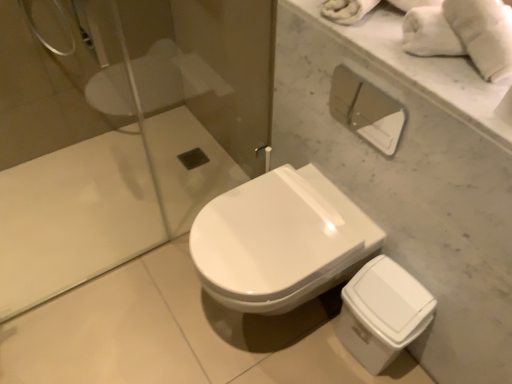
Question: Considering the relative sizes of white fluffy towel at upper right and white matte toilet paper at upper right in the image provided, is white fluffy towel at upper right thinner than white matte toilet paper at upper right?

Choices:
 (A) yes
 (B) no

Answer: (B)

Question: Would you say white fluffy towel at upper right is a long distance from white matte toilet paper at upper right?

Choices:
 (A) no
 (B) yes

Answer: (A)

Question: From a real-world perspective, does white fluffy towel at upper right sit lower than white matte toilet paper at upper right?

Choices:
 (A) yes
 (B) no

Answer: (B)

Question: Is the position of white fluffy towel at upper right less distant than that of white matte toilet paper at upper right?

Choices:
 (A) yes
 (B) no

Answer: (A)

Question: Is white fluffy towel at upper right with white matte toilet paper at upper right?

Choices:
 (A) yes
 (B) no

Answer: (B)

Question: Considering the relative sizes of white fluffy towel at upper right and white matte toilet paper at upper right in the image provided, is white fluffy towel at upper right smaller than white matte toilet paper at upper right?

Choices:
 (A) yes
 (B) no

Answer: (B)

Question: Considering the relative sizes of white matte toilet paper at upper right and white fluffy towel at upper right in the image provided, is white matte toilet paper at upper right wider than white fluffy towel at upper right?

Choices:
 (A) no
 (B) yes

Answer: (A)

Question: Is white matte toilet paper at upper right not within white fluffy towel at upper right?

Choices:
 (A) no
 (B) yes

Answer: (B)

Question: Is white matte toilet paper at upper right closer to camera compared to white fluffy towel at upper right?

Choices:
 (A) no
 (B) yes

Answer: (A)

Question: Are white matte toilet paper at upper right and white fluffy towel at upper right beside each other?

Choices:
 (A) no
 (B) yes

Answer: (A)

Question: Considering the relative sizes of white matte toilet paper at upper right and white fluffy towel at upper right in the image provided, is white matte toilet paper at upper right smaller than white fluffy towel at upper right?

Choices:
 (A) yes
 (B) no

Answer: (A)

Question: Would you say white matte toilet paper at upper right is a long distance from white fluffy towel at upper right?

Choices:
 (A) yes
 (B) no

Answer: (B)

Question: Is there a large distance between white glossy toilet at center and white fluffy towel at upper right?

Choices:
 (A) yes
 (B) no

Answer: (B)